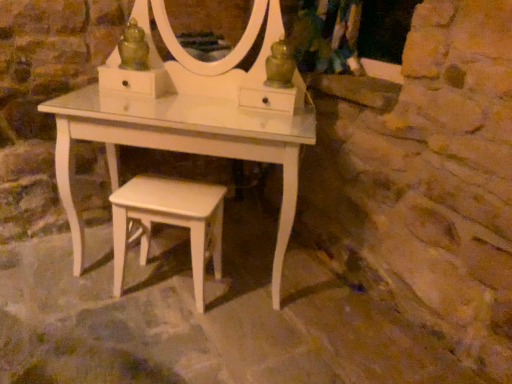
In order to click on white matte stool at center in this screenshot , I will do `click(170, 222)`.

Describe the element at coordinates (170, 222) in the screenshot. The image size is (512, 384). I see `white matte stool at center` at that location.

Identify the location of white matte stool at center. The image size is (512, 384). (170, 222).